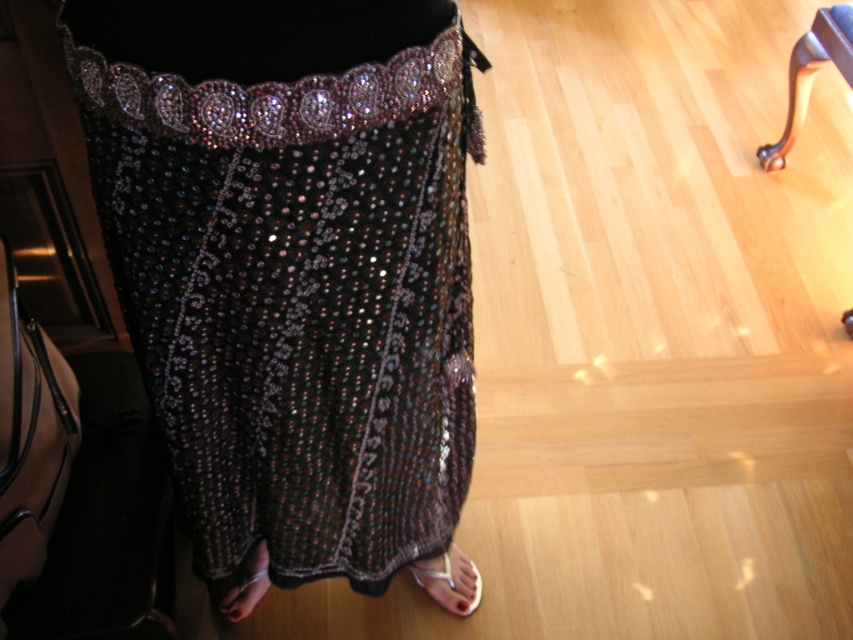
You are a fashion designer trying to decide if the shiny sequined dress at center will fit through a doorway next to the polished wood leg at upper right. Based on their widths, can the dress pass through the doorway?

The shiny sequined dress at center is wider than the polished wood leg at upper right. Since the doorway is next to the leg, the dress may not fit through if the doorway width is narrower than the dress. However, without knowing the doorway width, we can only confirm the dress is wider than the leg.

You are a photographer trying to capture the intricate details of the black sequined skirt. You notice two points on the skirt, point (816, 12) and point (265, 554). Which point is closer to your camera lens?

Point (816, 12) is further to the viewer than point (265, 554), so the point closer to the camera lens is point (265, 554).

You are a fashion designer trying to create a matching accessory for the shiny metallic sandal at lower center. The accessory needs to have a width that is wider than the polished wood leg at upper right. Which object should you use as a reference for the width of your accessory design?

The accessory should be wider than the polished wood leg at upper right. Since the shiny metallic sandal at lower center is wider than the polished wood leg at upper right, you can use the shiny metallic sandal at lower center as a reference for the width of your accessory design.